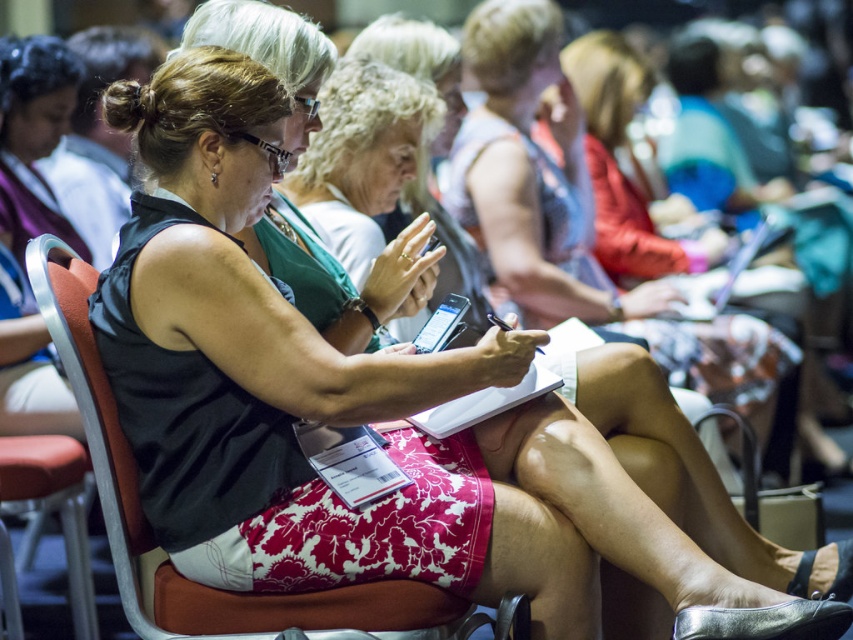
Does pink floral skirt at center appear under red fabric chair at center?

Incorrect, pink floral skirt at center is not positioned below red fabric chair at center.

Is point (497, 141) positioned before point (456, 609)?

No, it is behind (456, 609).

I want to click on pink floral skirt at center, so click(x=532, y=173).